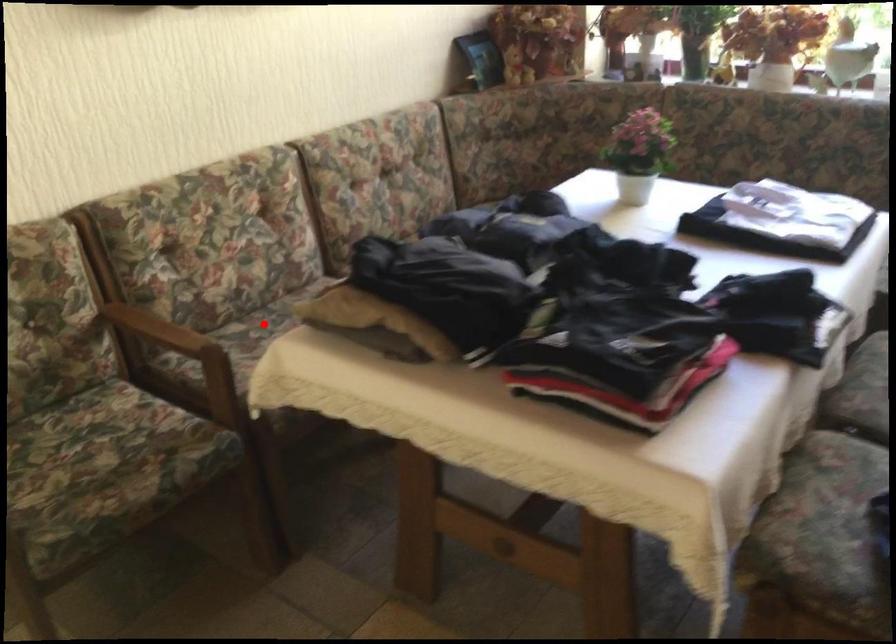
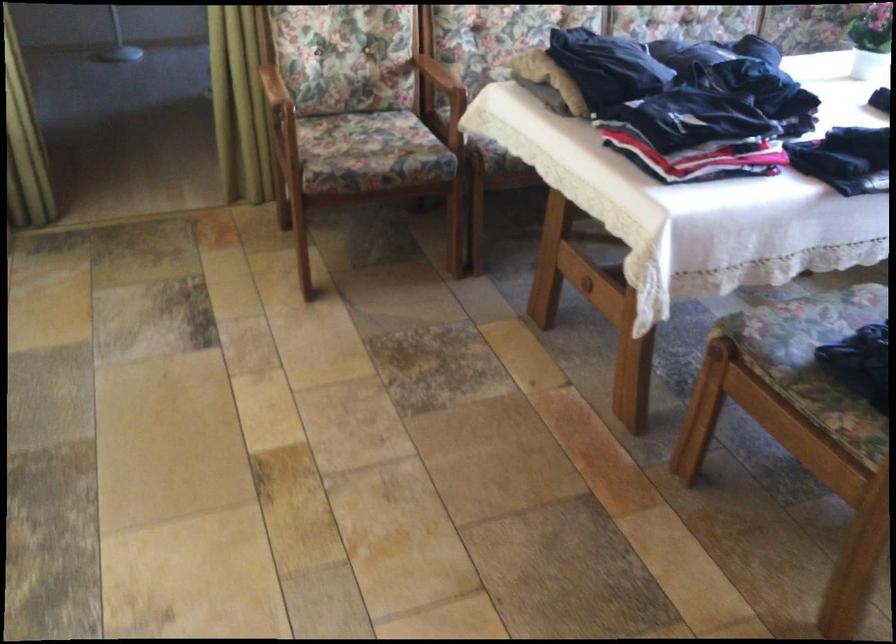
Question: I am providing you with two images of the same scene from different viewpoints. A red point is marked on the first image. Is the red point's position out of view in image 2?

Choices:
 (A) Yes
 (B) No

Answer: (A)